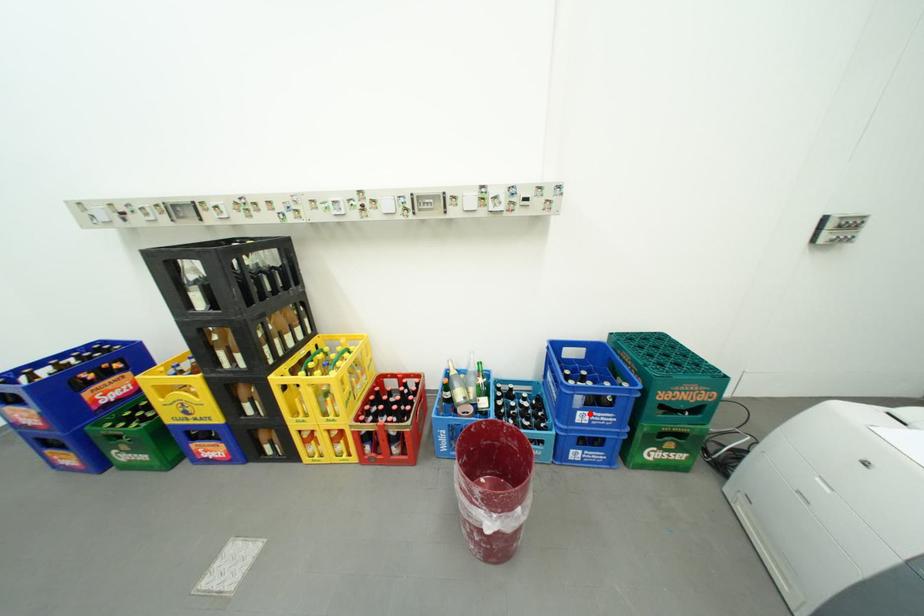
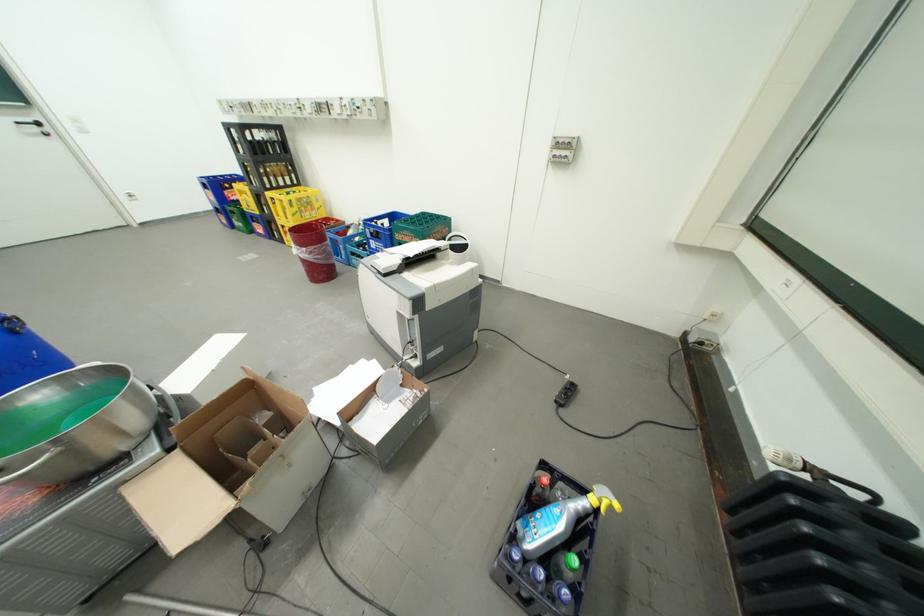
The point at the highlighted location is marked in the first image. Where is the corresponding point in the second image?

(381, 241)